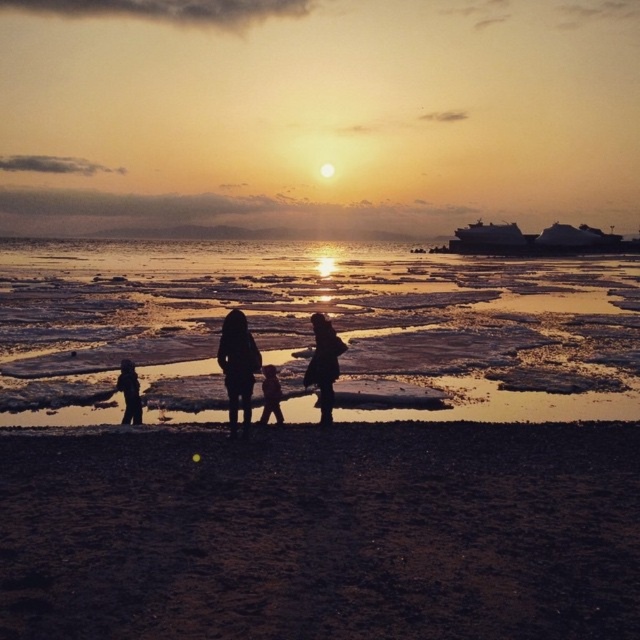
In the scene shown: You are standing on the beach looking at the sunset. There are two points marked on the sand in front of you. The first point is at coordinates point (230, 396) and the second is at point (136, 396). Which point is closer to your current position?

Point (230, 396) is closer to the camera than point (136, 396), so the first point is closer to your current position.